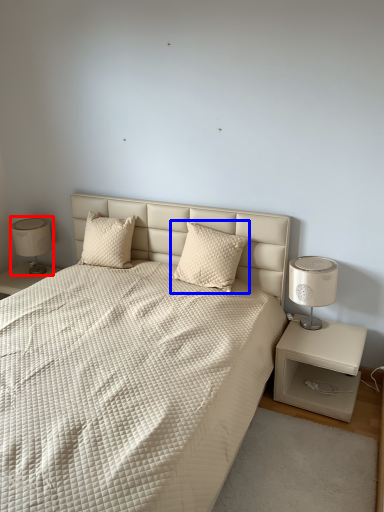
Question: Which object is further to the camera taking this photo, table lamp (highlighted by a red box) or pillow (highlighted by a blue box)?

Choices:
 (A) table lamp
 (B) pillow

Answer: (A)